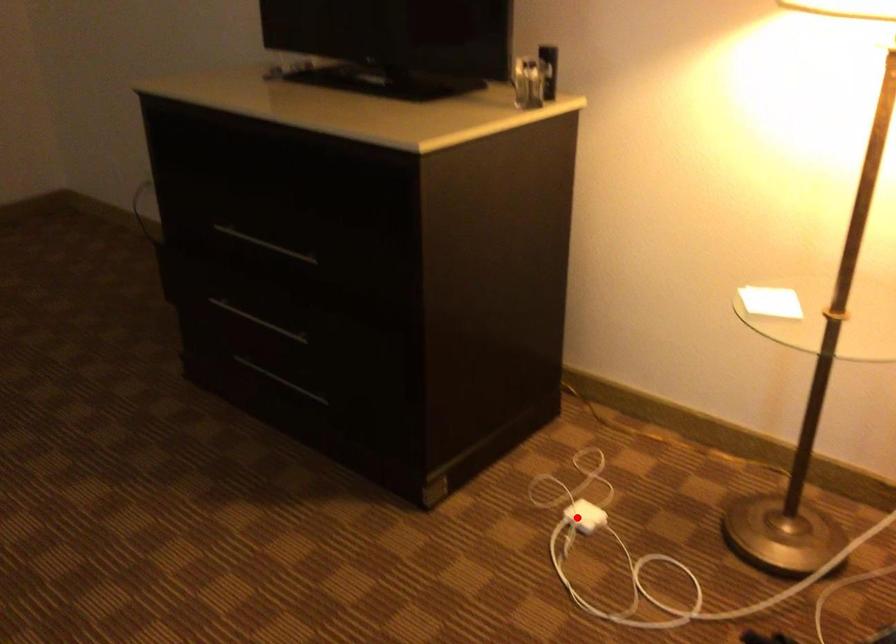
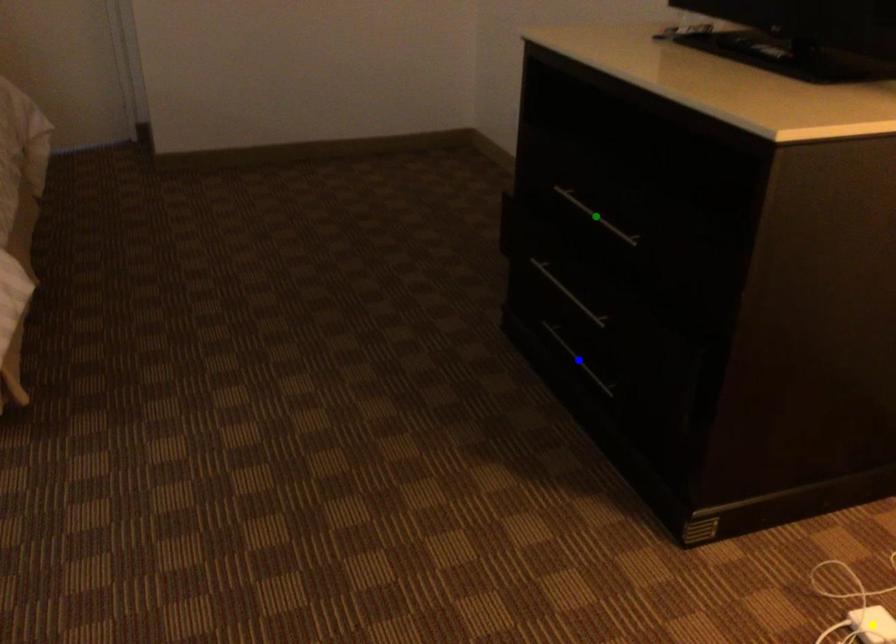
Question: I am providing you with two images of the same scene from different viewpoints. A red point is marked on the first image. You are given multiple points on the second image. In image 2, which mark is for the same physical point as the one in image 1?

Choices:
 (A) green point
 (B) yellow point
 (C) blue point

Answer: (B)